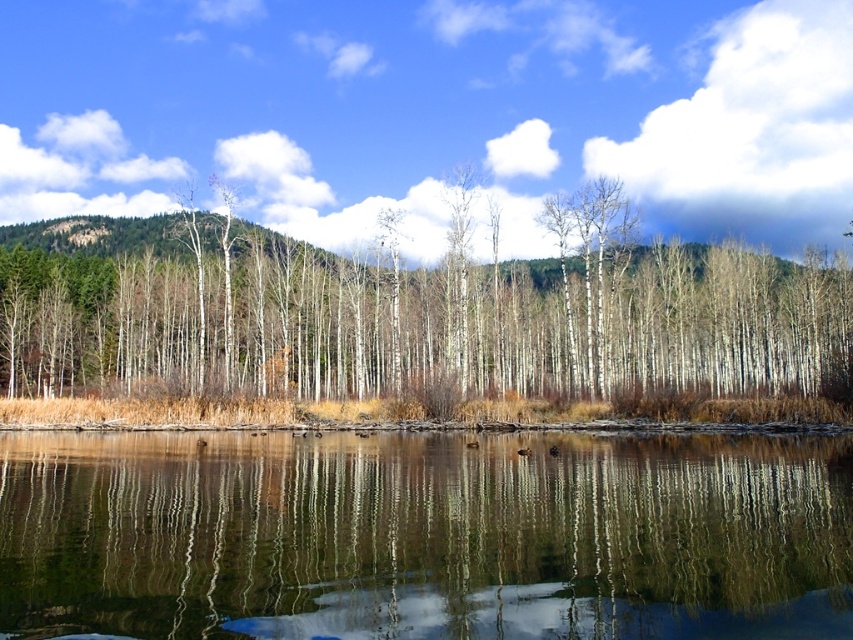
Question: Is transparent water at center thinner than white smooth trees at center?

Choices:
 (A) yes
 (B) no

Answer: (A)

Question: Can you confirm if transparent water at center is thinner than white smooth trees at center?

Choices:
 (A) no
 (B) yes

Answer: (B)

Question: Which object appears closest to the camera in this image?

Choices:
 (A) transparent water at center
 (B) white smooth trees at center

Answer: (A)

Question: Among these points, which one is farthest from the camera?

Choices:
 (A) (260, 296)
 (B) (770, 561)

Answer: (A)

Question: Can you confirm if transparent water at center is bigger than white smooth trees at center?

Choices:
 (A) no
 (B) yes

Answer: (A)